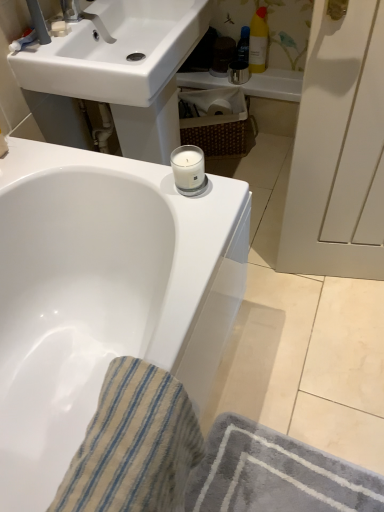
Locate an element on the screen. The width and height of the screenshot is (384, 512). free space in front of yellow matte bottle at upper right, which appears as the 1th toiletry when viewed from the right is located at coordinates (274, 80).